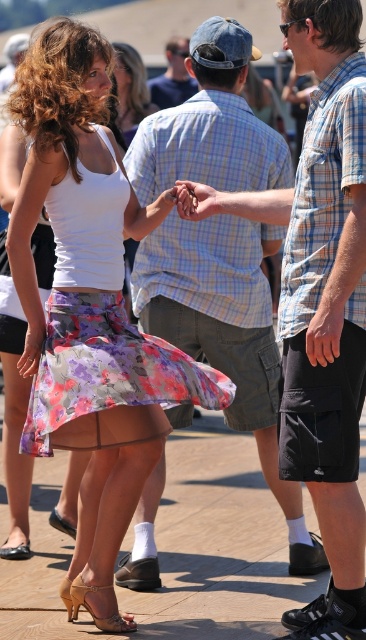
Who is shorter, floral cotton skirt at center or denim cap at center?

→ Standing shorter between the two is denim cap at center.

Does floral cotton skirt at center lie behind denim cap at center?

No, floral cotton skirt at center is closer to the viewer.

Image resolution: width=366 pixels, height=640 pixels. What do you see at coordinates (102, 339) in the screenshot?
I see `floral cotton skirt at center` at bounding box center [102, 339].

The height and width of the screenshot is (640, 366). In order to click on floral cotton skirt at center in this screenshot , I will do `click(102, 339)`.

Does blonde hair at center have a larger size compared to matte skin hand at center?

Indeed, blonde hair at center has a larger size compared to matte skin hand at center.

Which is in front, point (128, 113) or point (187, 195)?

Point (187, 195) is more forward.

Locate an element on the screen. blonde hair at center is located at coordinates (131, 90).

Which is more to the left, light blue plaid shirt at center or floral cotton skirt at center?

Positioned to the left is floral cotton skirt at center.

Is point (238, 404) positioned behind point (79, 436)?

Yes, it is.

Find the location of `light blue plaid shirt at center`. light blue plaid shirt at center is located at coordinates (225, 333).